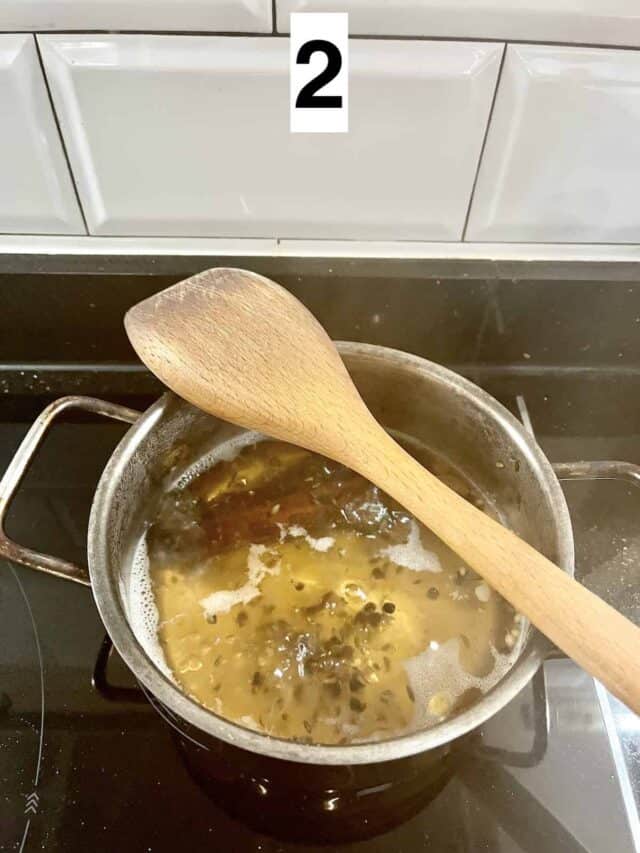
Where is `black glass stove top, electric`? The image size is (640, 853). black glass stove top, electric is located at coordinates (543, 793).